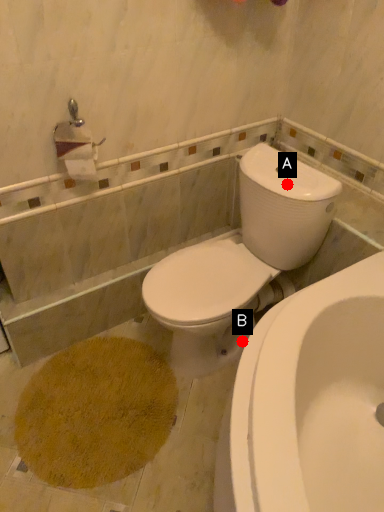
Question: Two points are circled on the image, labeled by A and B beside each circle. Which point appears farthest from the camera in this image?

Choices:
 (A) A is further
 (B) B is further

Answer: (B)